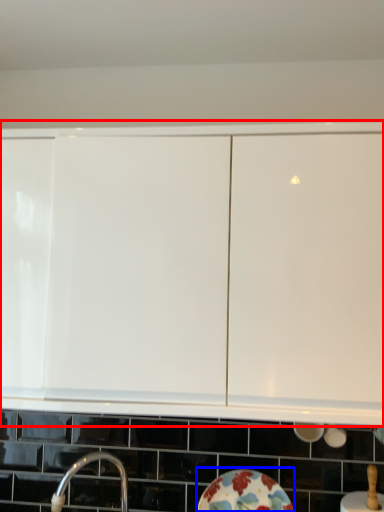
Question: Which object is further to the camera taking this photo, cabinetry (highlighted by a red box) or plate (highlighted by a blue box)?

Choices:
 (A) cabinetry
 (B) plate

Answer: (B)